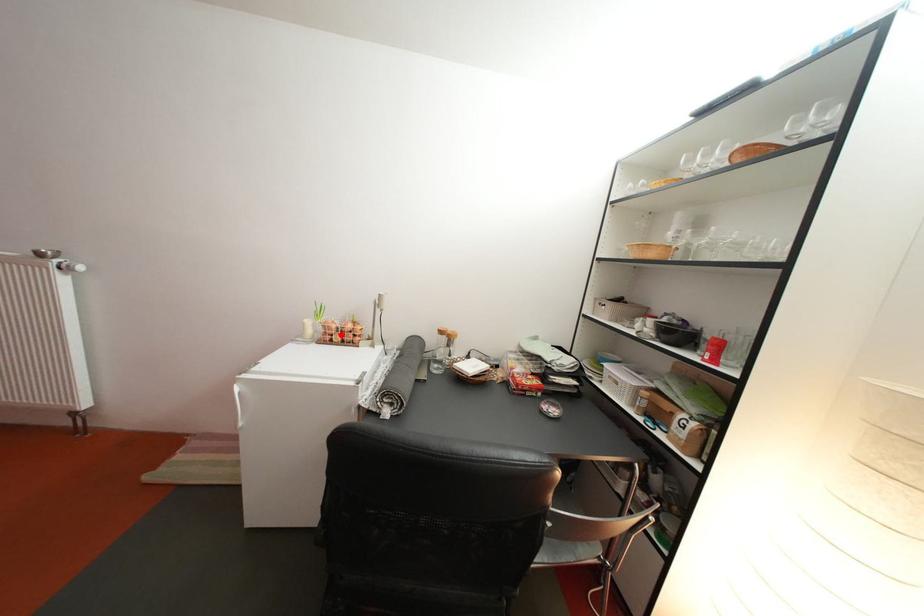
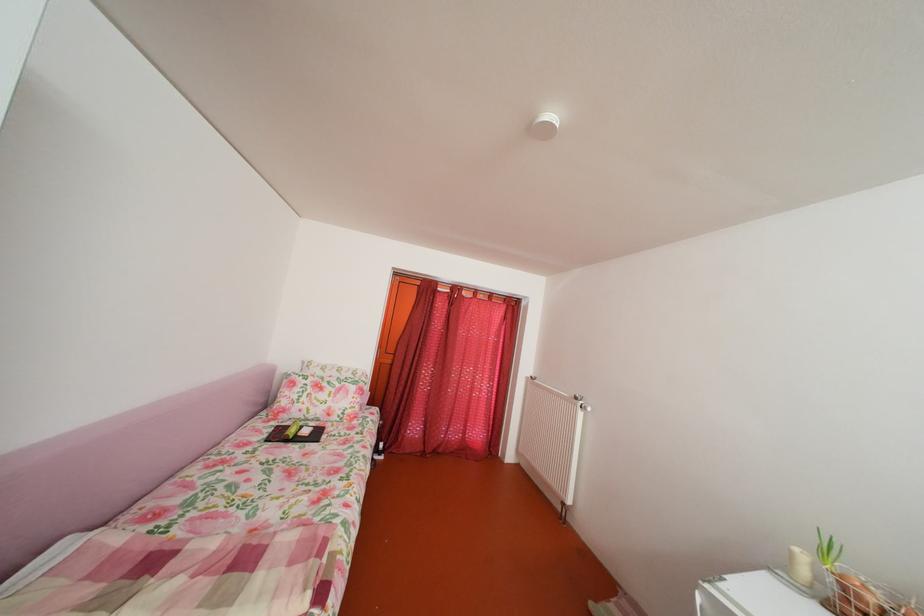
Question: I am providing you with two images of the same scene from different viewpoints. A red point is shown in image1. For the corresponding object point in image2, is it positioned nearer or farther from the camera?

Choices:
 (A) Nearer
 (B) Farther

Answer: (A)